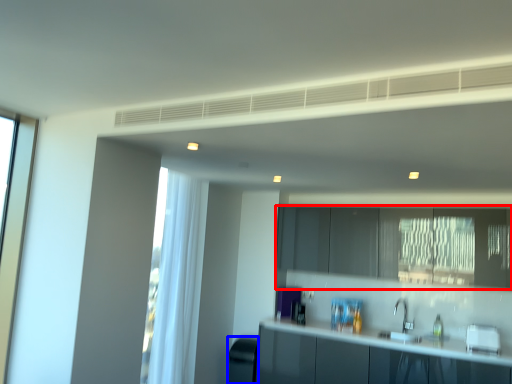
Question: Which object appears closest to the camera in this image, cabinetry (highlighted by a red box) or appliance (highlighted by a blue box)?

Choices:
 (A) cabinetry
 (B) appliance

Answer: (A)